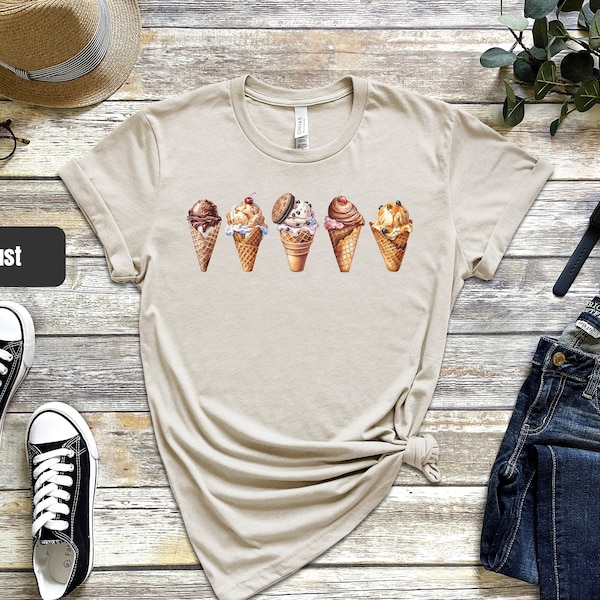
Where is `wooden surface`? This screenshot has height=600, width=600. wooden surface is located at coordinates (82, 314).